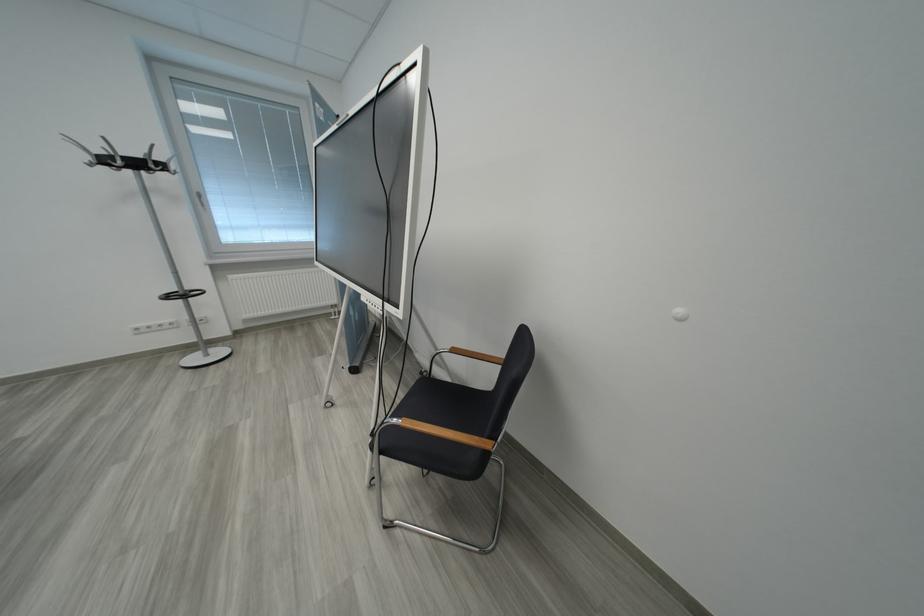
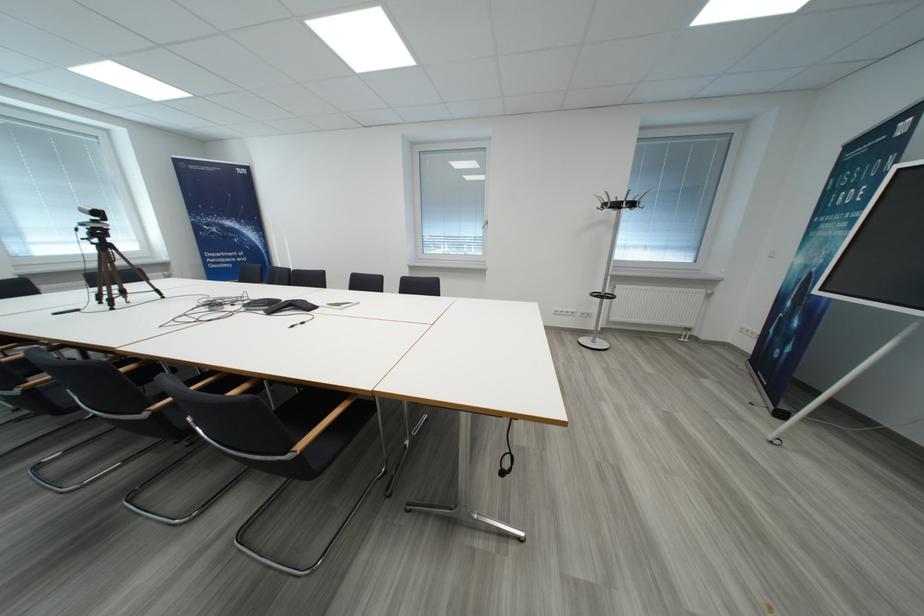
In the second image, find the point that corresponds to point (112, 163) in the first image.

(623, 208)